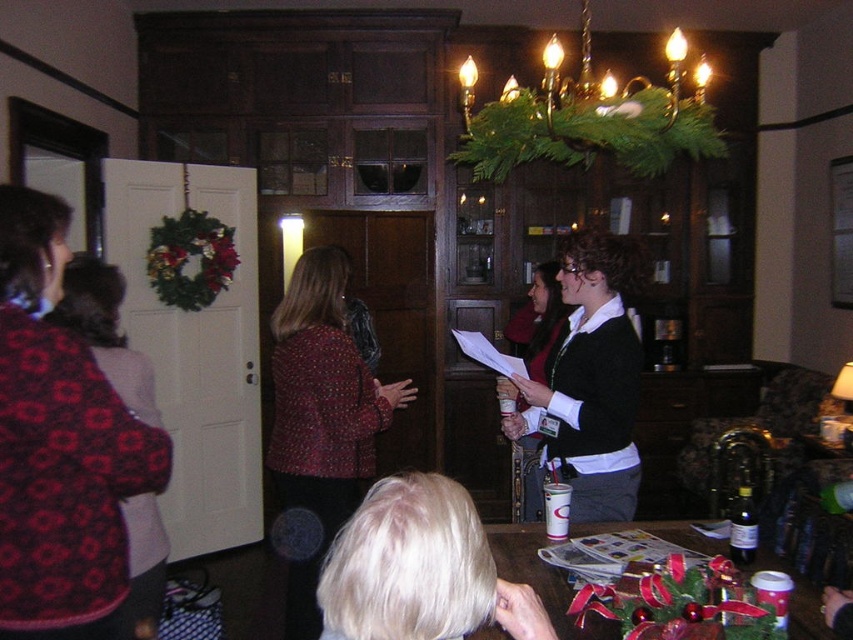
You are organizing a small event and need to arrange seating for two guests wearing the black sweater at center and the red patterned sweater at left. Given their clothing dimensions, which guest should you seat in a wider chair to accommodate their sweater?

The guest wearing the red patterned sweater at left requires a wider chair since the red patterned sweater at left is wider than the black sweater at center.

You are standing in the room and want to take a photo of the point at coordinates point (279, 330). Based on the description, is the point within your camera frame?

The point (279, 330) is 8.76 feet away from the camera. Since the camera frame typically includes objects within a reasonable distance, the point is likely within the camera frame.

You are at a holiday party and see two people wearing red clothing. The red textured blazer at center and the red patterned sweater at left. Which person is closer to the floor?

The red textured blazer at center is below the red patterned sweater at left, so the person wearing the red textured blazer at center is closer to the floor.